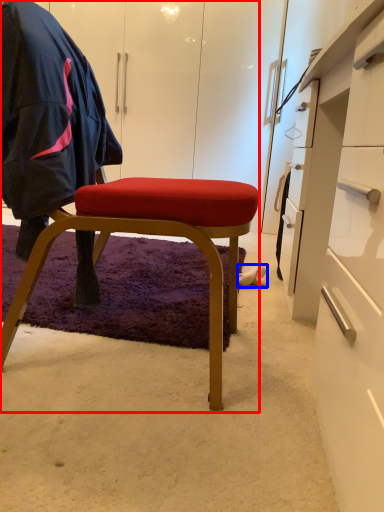
Question: Which of the following is the farthest to the observer, chair (highlighted by a red box) or footwear (highlighted by a blue box)?

Choices:
 (A) chair
 (B) footwear

Answer: (B)